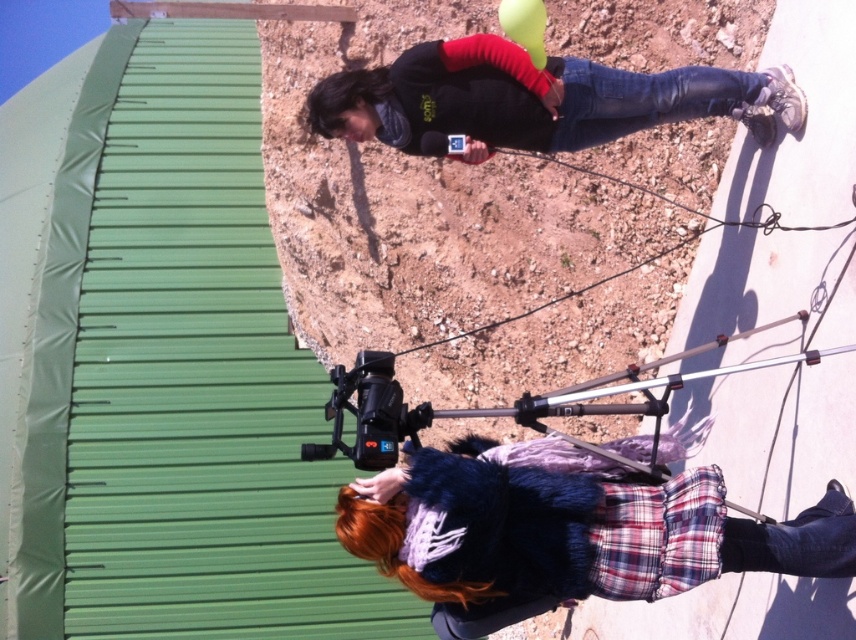
Question: Does fluffy blue coat at lower center appear on the left side of jeans at lower right?

Choices:
 (A) no
 (B) yes

Answer: (B)

Question: Can you confirm if fluffy blue coat at lower center is positioned to the left of jeans at lower right?

Choices:
 (A) yes
 (B) no

Answer: (A)

Question: Which object appears farthest from the camera in this image?

Choices:
 (A) black plastic video camera at center
 (B) jeans at lower right
 (C) fluffy blue coat at lower center

Answer: (B)

Question: Is fluffy blue coat at lower center positioned before dark gray fleece jacket at upper center?

Choices:
 (A) yes
 (B) no

Answer: (A)

Question: Which of these objects is positioned farthest from the fluffy blue coat at lower center?

Choices:
 (A) metallic silver tripod at center
 (B) jeans at lower right
 (C) black plastic video camera at center
 (D) dark gray fleece jacket at upper center

Answer: (D)

Question: Which object is closer to the camera taking this photo?

Choices:
 (A) jeans at lower right
 (B) fluffy blue coat at lower center
 (C) black plastic video camera at center

Answer: (C)